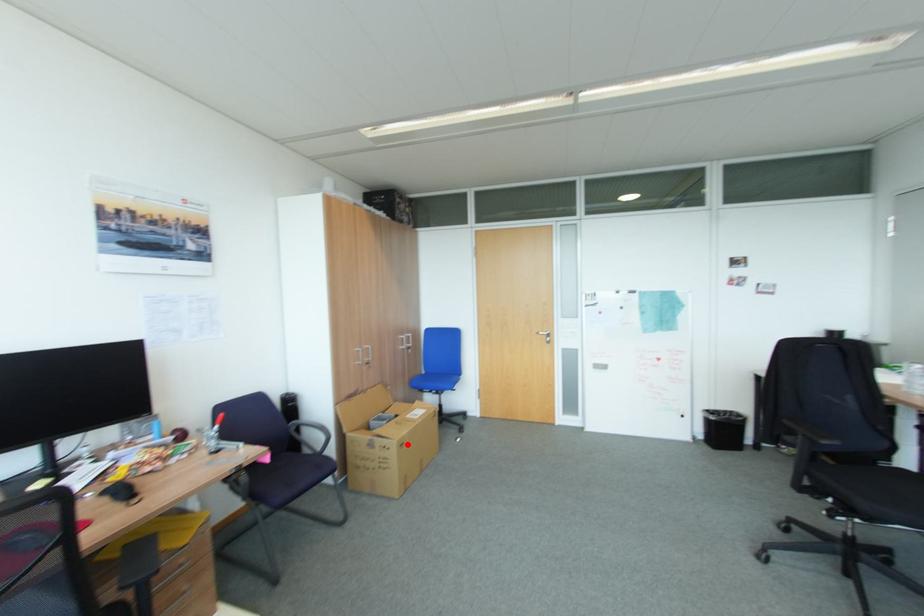
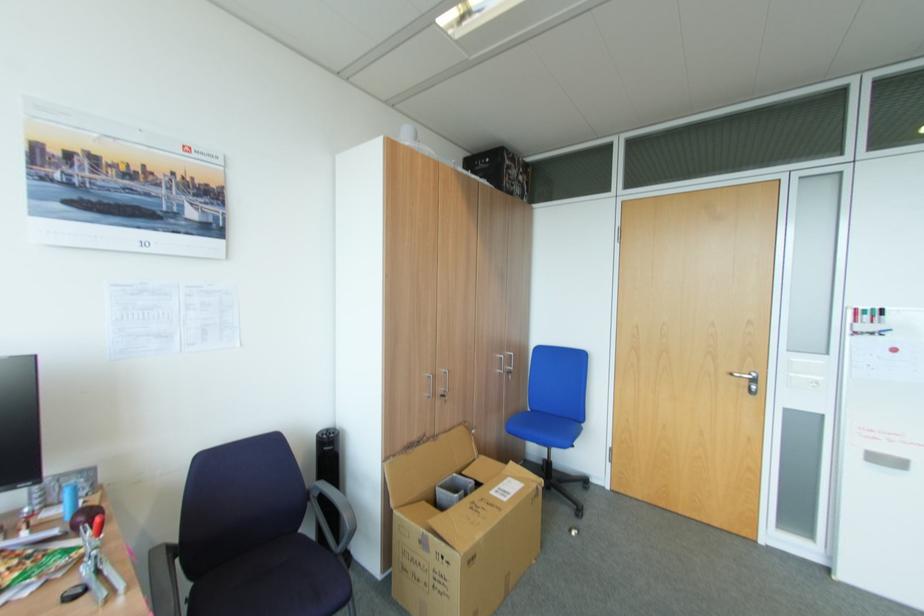
Find the pixel in the second image that matches the highlighted location in the first image.

(479, 556)